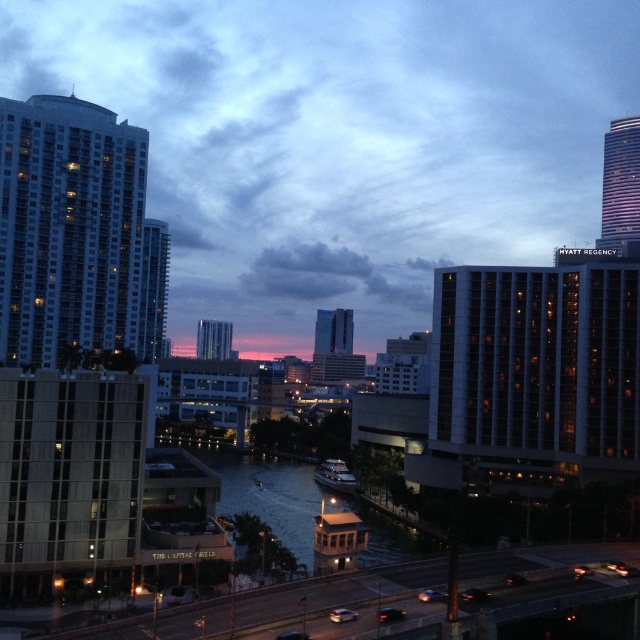
Consider the image. Is the position of matte glass building at left less distant than that of smooth glass skyscraper at center?

Yes, it is in front of smooth glass skyscraper at center.

Is point (116, 240) farther from camera compared to point (339, 320)?

No, it is in front of (339, 320).

Locate an element on the screen. matte glass building at left is located at coordinates (68, 228).

Does shiny glass skyscraper at upper right appear over matte glass skyscraper at center?

Indeed, shiny glass skyscraper at upper right is positioned over matte glass skyscraper at center.

Which of these two, shiny glass skyscraper at upper right or matte glass skyscraper at center, stands shorter?

matte glass skyscraper at center

Where is `shiny glass skyscraper at upper right`? shiny glass skyscraper at upper right is located at coordinates (620, 184).

Which is more to the left, shiny glass skyscraper at upper right or smooth glass skyscraper at center?

→ Positioned to the left is smooth glass skyscraper at center.

Who is taller, shiny glass skyscraper at upper right or smooth glass skyscraper at center?

Standing taller between the two is shiny glass skyscraper at upper right.

Image resolution: width=640 pixels, height=640 pixels. In order to click on shiny glass skyscraper at upper right in this screenshot , I will do `click(620, 184)`.